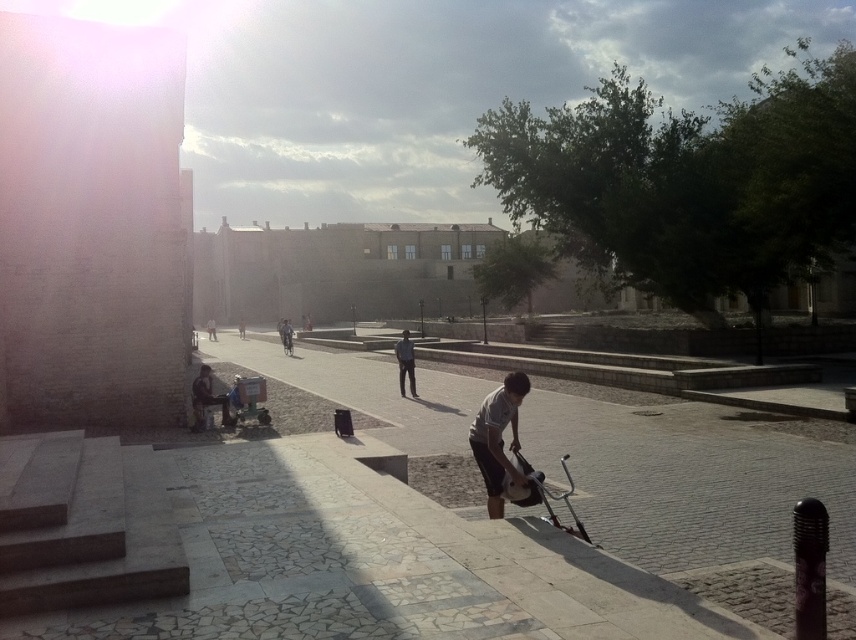
Question: Considering the real-world distances, which object is closest to the gray matte skateboard at center?

Choices:
 (A) dark gray jeans at center
 (B) metallic silver baby carriage at lower right
 (C) gray stone pavement at center

Answer: (B)

Question: Can you confirm if metallic silver baby carriage at lower right is positioned to the right of dark gray jeans at center?

Choices:
 (A) yes
 (B) no

Answer: (A)

Question: Which object is closer to the camera taking this photo?

Choices:
 (A) metallic silver baby carriage at lower right
 (B) gray matte skateboard at center
 (C) gray stone pavement at center
 (D) dark gray jeans at center

Answer: (A)

Question: Which object is farther from the camera taking this photo?

Choices:
 (A) gray stone pavement at center
 (B) metallic silver baby carriage at lower right
 (C) dark gray jeans at center
 (D) gray matte skateboard at center

Answer: (C)

Question: Is gray stone pavement at center wider than gray matte skateboard at center?

Choices:
 (A) no
 (B) yes

Answer: (B)

Question: Does metallic silver baby carriage at lower right appear on the left side of dark gray jeans at center?

Choices:
 (A) yes
 (B) no

Answer: (B)